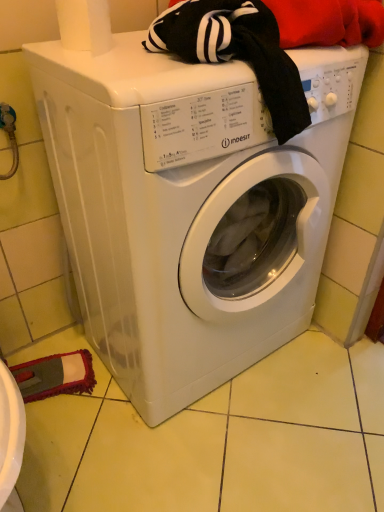
You are a GUI agent. You are given a task and a screenshot of the screen. Output one action in this format:
    pyautogui.click(x=<x>, y=<y>)
    Task: Click on the free location in front of white paper towel at upper left
    The image size is (384, 512).
    Given the screenshot: What is the action you would take?
    pyautogui.click(x=108, y=68)